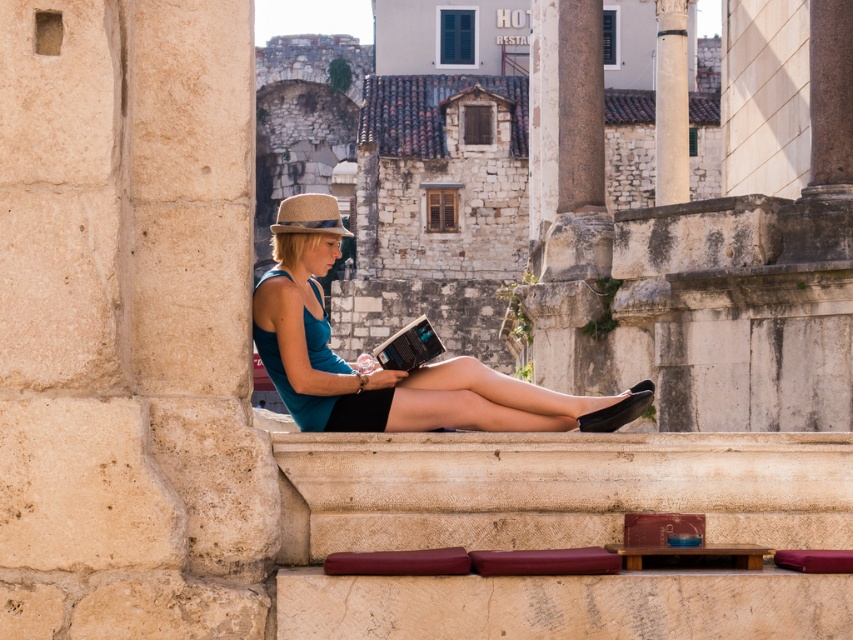
You are a tour guide explaining the historical site to visitors. Pointing to the teal fabric dress at center and the white marble pillar at upper center, you want to describe their positions. Which object is positioned higher in the image?

The white marble pillar at upper center is positioned higher in the image than the teal fabric dress at center.